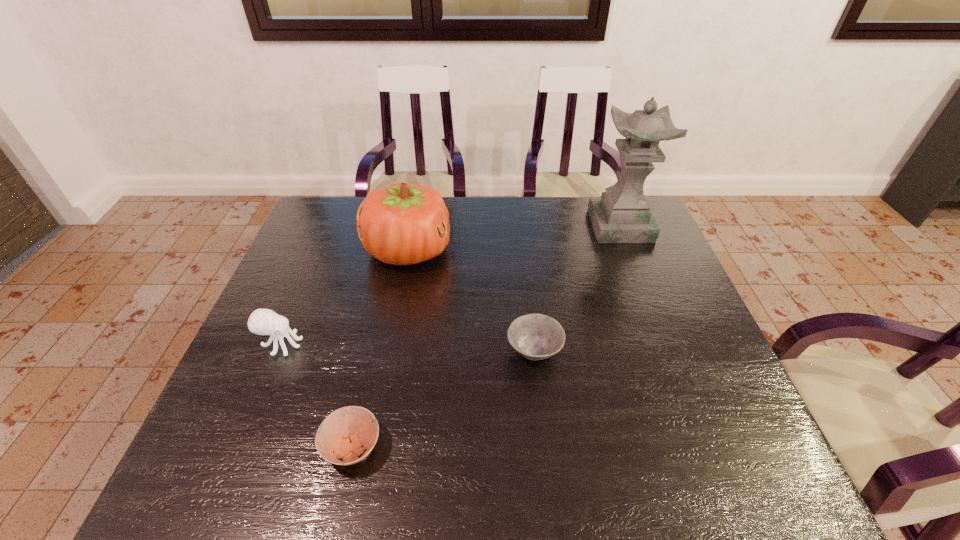
You are a GUI agent. You are given a task and a screenshot of the screen. Output one action in this format:
    pyautogui.click(x=<x>, y=<y>)
    Task: Click on the sculpture
    
    Given the screenshot: What is the action you would take?
    pyautogui.click(x=622, y=214)

This screenshot has width=960, height=540. What are the coordinates of `the rightmost object` in the screenshot? It's located at (622, 214).

Find the location of `pumpkin`. pumpkin is located at coordinates (402, 223).

Where is `the leftmost object`? the leftmost object is located at coordinates (262, 321).

Find the location of a particular element. octopus is located at coordinates (x=262, y=321).

Find the location of `the fourth object from left to right`. the fourth object from left to right is located at coordinates (535, 336).

Identify the location of the fourth tallest object. (535, 336).

At what (x,y) coordinates should I click in order to perform the action: click on the nearest object. Please return your answer as a coordinate pair (x, y). The image size is (960, 540). Looking at the image, I should click on (344, 432).

Identify the location of the nearer bowl. The height and width of the screenshot is (540, 960). (344, 432).

Find the location of a particular element. free space located at the front opening of the tallest object is located at coordinates (660, 327).